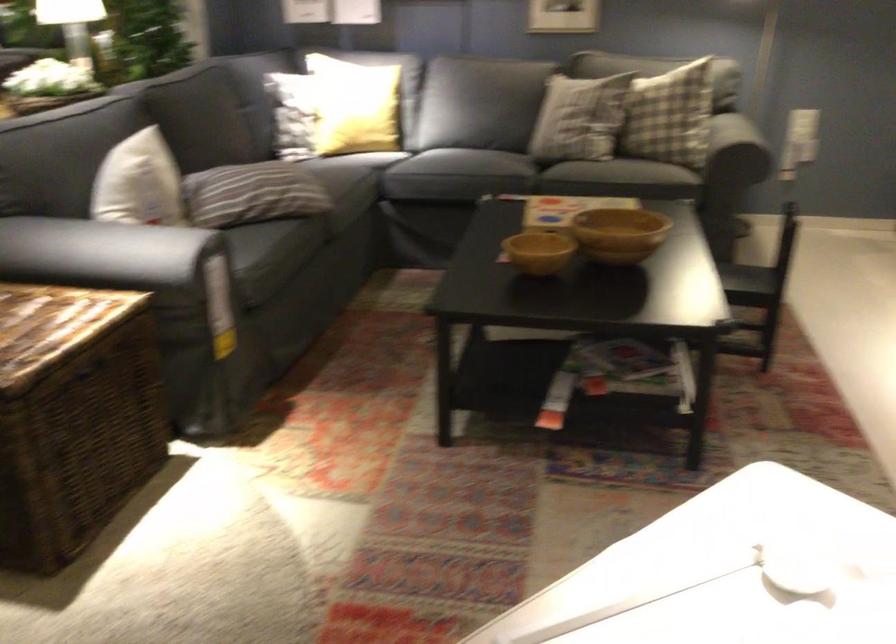
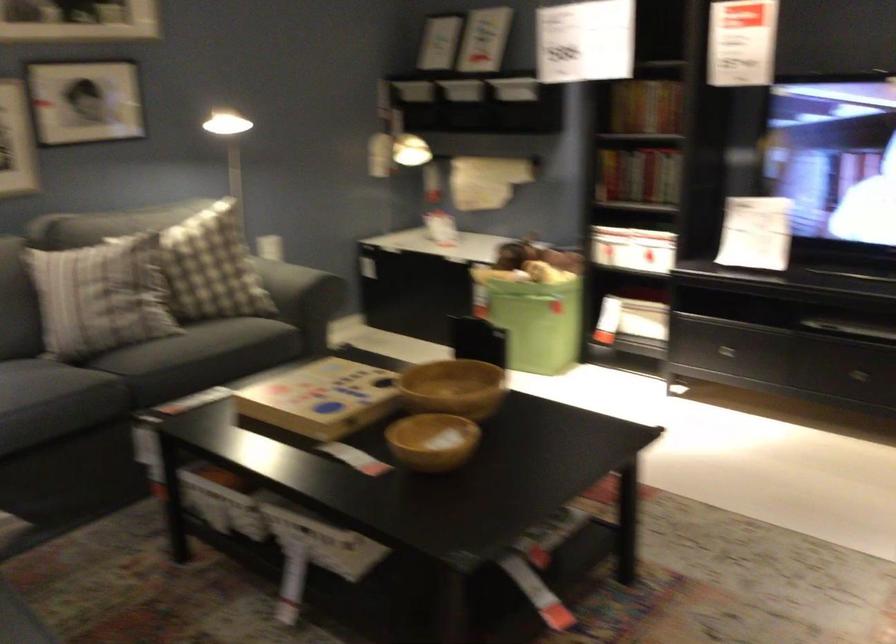
Locate, in the second image, the point that corresponds to (634,100) in the first image.

(211, 267)